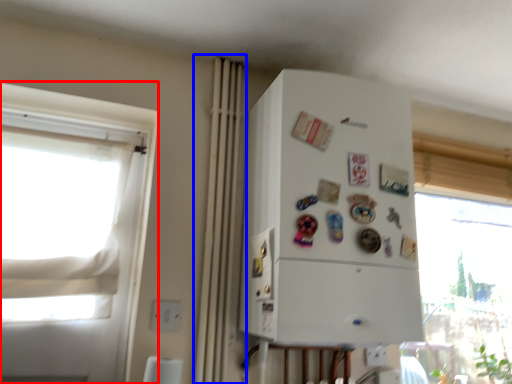
Question: Which object is further to the camera taking this photo, window (highlighted by a red box) or curtain (highlighted by a blue box)?

Choices:
 (A) window
 (B) curtain

Answer: (B)